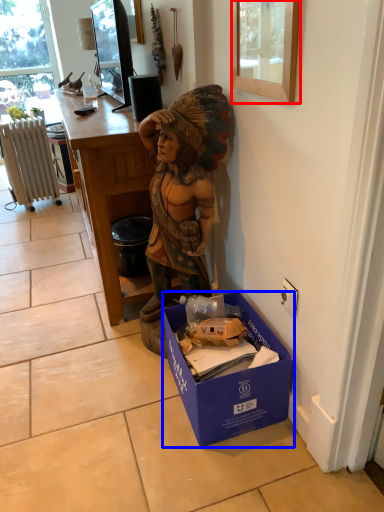
Question: Which of the following is the farthest to the observer, picture frame (highlighted by a red box) or box (highlighted by a blue box)?

Choices:
 (A) picture frame
 (B) box

Answer: (B)